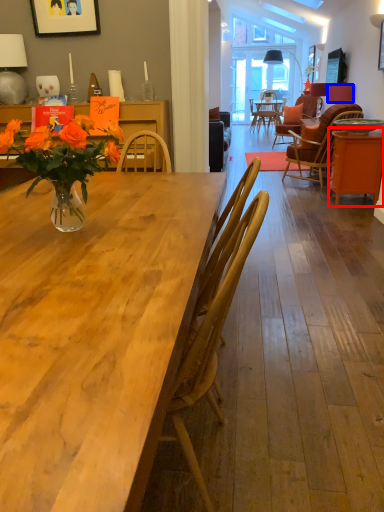
Question: Which of the following is the closest to the observer, table (highlighted by a red box) or lamp (highlighted by a blue box)?

Choices:
 (A) table
 (B) lamp

Answer: (A)